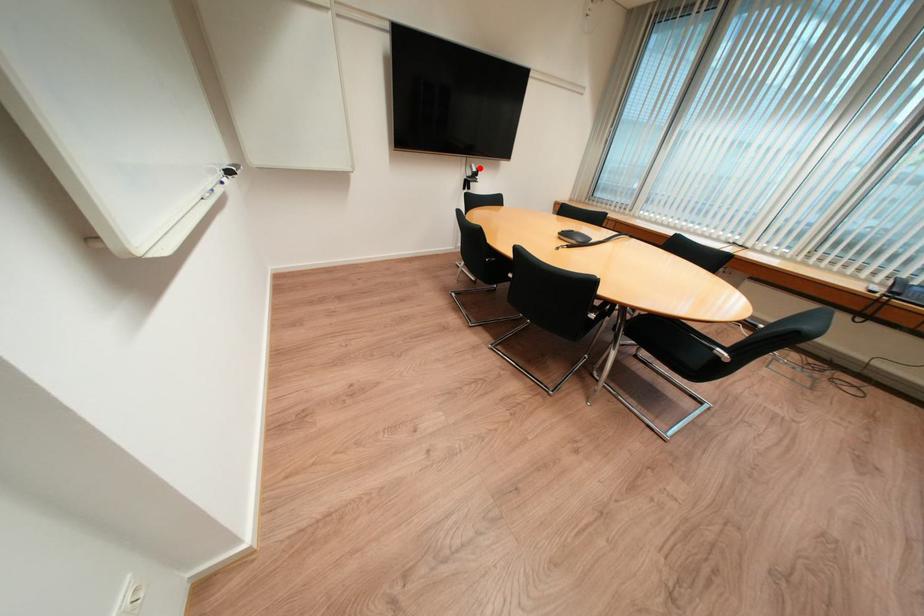
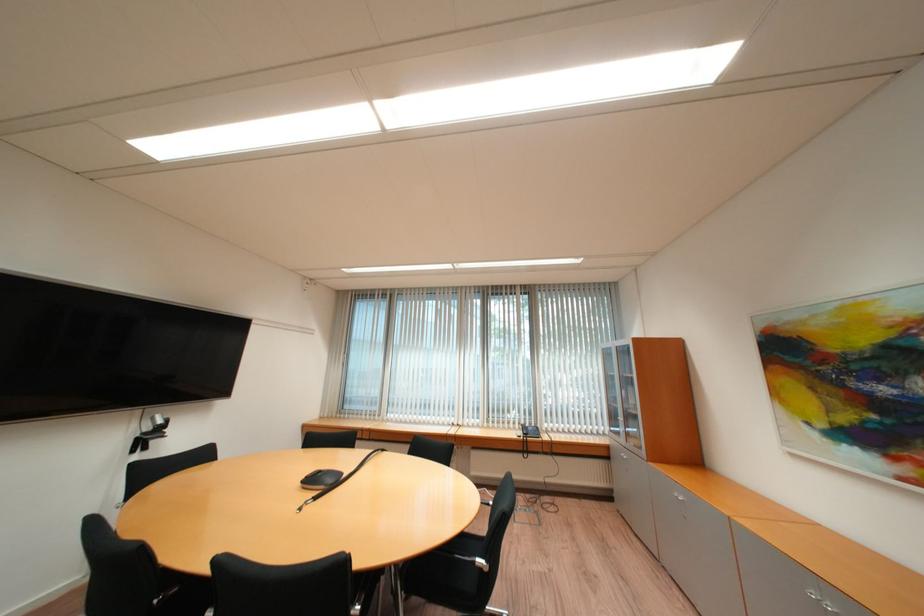
Question: I am providing you with two images of the same scene from different viewpoints. Image1 has a red point marked. In image2, the corresponding 3D location appears at what relative position? Reply with the corresponding letter.

Choices:
 (A) Closer
 (B) Farther

Answer: (B)